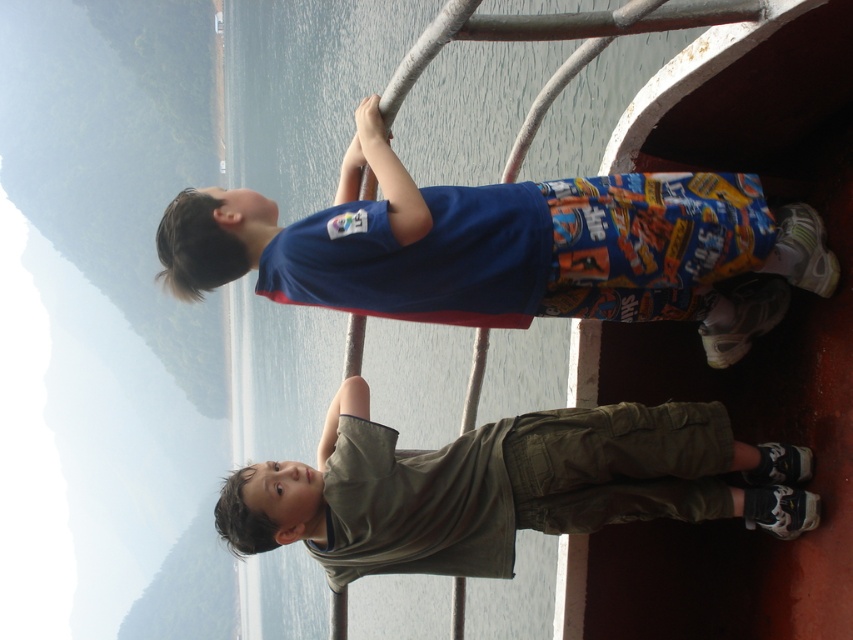
Describe the element at coordinates (508, 248) in the screenshot. I see `blue cotton shirt at upper center` at that location.

Does point (402, 317) come closer to viewer compared to point (525, 424)?

Yes, it is.

This screenshot has width=853, height=640. I want to click on blue cotton shirt at upper center, so click(508, 248).